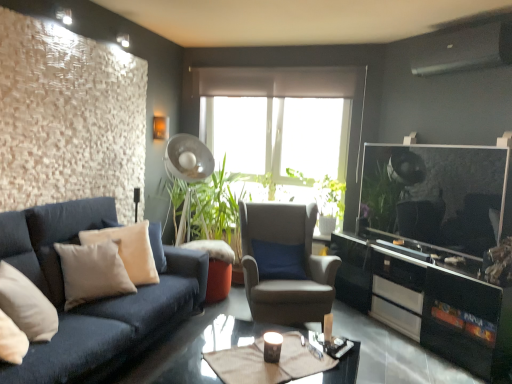
Question: From a real-world perspective, is metallic silver fan at center above or below beige fabric pillow at left, the first pillow viewed from the back?

Choices:
 (A) below
 (B) above

Answer: (B)

Question: From the image's perspective, is metallic silver fan at center positioned above or below beige fabric pillow at left, positioned as the second pillow in front-to-back order?

Choices:
 (A) below
 (B) above

Answer: (B)

Question: Based on their relative distances, which object is farther from the metallic silver fan at center?

Choices:
 (A) beige velvet pillow at left, positioned as the 1th pillow in front-to-back order
 (B) black glossy cabinet at right
 (C) matte brown table at center
 (D) suede-like gray armchair at center
 (E) beige fabric pillow at left, positioned as the second pillow in front-to-back order

Answer: (C)

Question: Considering the real-world distances, which object is closest to the beige fabric pillow at left, the first pillow viewed from the back?

Choices:
 (A) metallic silver fan at center
 (B) beige velvet pillow at left, positioned as the 1th pillow in front-to-back order
 (C) shiny black glass coffee table at center
 (D) matte brown table at center
 (E) black glossy cabinet at right

Answer: (B)